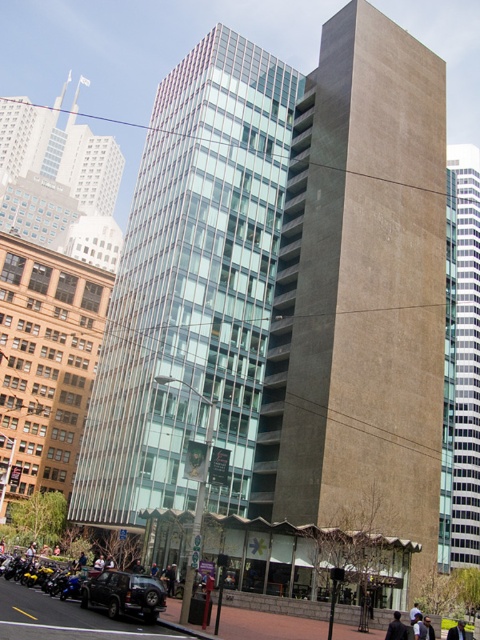
You are a drone operator tasked with delivering a package to a person wearing a dark gray suit at center. The brown concrete tower at center is in your flight path. Can you safely navigate between them without hitting the tower?

The brown concrete tower at center and dark gray suit at center are 35.19 meters apart from each other, so yes, the drone can safely navigate between them since the distance is sufficient to avoid collision.

You are standing in front of the tall building and looking at two points marked on its facade. The first point is at coordinates point (85, 573) and the second is at point (420, 637). Which point is closer to you?

Point (85, 573) is further to the camera than point (420, 637), so the point closer to you is point (420, 637).